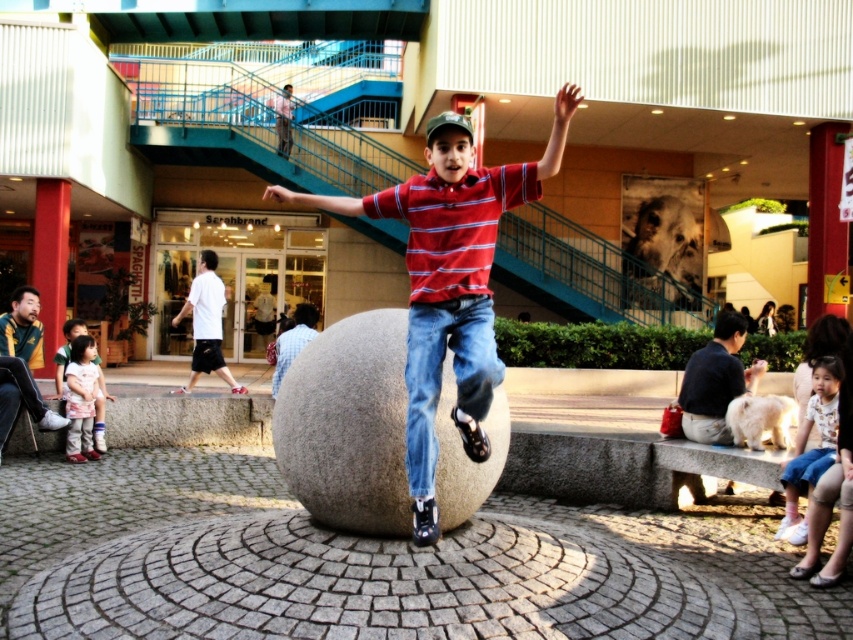
Between red striped shirt at center and matte pink shirt at lower left, which one is positioned higher?

red striped shirt at center is above.

The width and height of the screenshot is (853, 640). Describe the element at coordinates (450, 285) in the screenshot. I see `red striped shirt at center` at that location.

Where is `red striped shirt at center`? red striped shirt at center is located at coordinates (450, 285).

Between point (802, 538) and point (90, 435), which one is positioned behind?

Positioned behind is point (90, 435).

Is light blue denim shorts at lower right further to the viewer compared to matte pink shirt at lower left?

No, light blue denim shorts at lower right is closer to the viewer.

Who is more forward, (828, 406) or (71, 368)?

Point (828, 406)

Find the location of a particular element. This screenshot has height=640, width=853. light blue denim shorts at lower right is located at coordinates (813, 448).

Can you confirm if blue denim jeans at center is positioned to the right of light blue denim shorts at lower right?

No, blue denim jeans at center is not to the right of light blue denim shorts at lower right.

Which is behind, point (480, 364) or point (810, 394)?

Point (810, 394)

The image size is (853, 640). In order to click on blue denim jeans at center in this screenshot , I will do `click(440, 380)`.